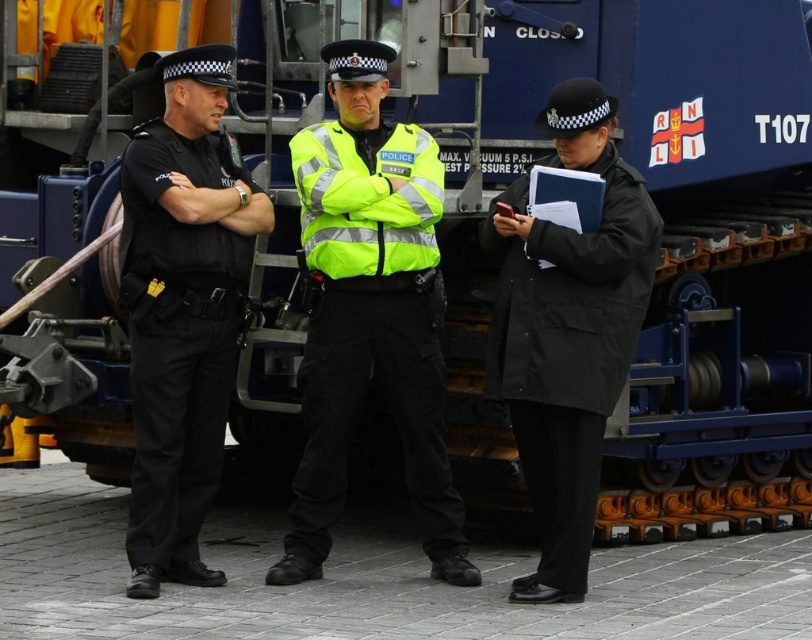
Question: Estimate the real-world distances between objects in this image. Which object is closer to the black uniform at left?

Choices:
 (A) black matte coat at center
 (B) neon yellow reflective jacket at center

Answer: (B)

Question: Is black uniform at left positioned in front of black matte coat at center?

Choices:
 (A) no
 (B) yes

Answer: (A)

Question: Can you confirm if neon yellow reflective jacket at center is positioned above black uniform at left?

Choices:
 (A) no
 (B) yes

Answer: (B)

Question: Does neon yellow reflective jacket at center appear over black matte coat at center?

Choices:
 (A) no
 (B) yes

Answer: (B)

Question: Which of these objects is positioned farthest from the black matte coat at center?

Choices:
 (A) black uniform at left
 (B) neon yellow reflective jacket at center

Answer: (A)

Question: Which point is closer to the camera?

Choices:
 (A) (223, 387)
 (B) (297, 532)
 (C) (504, 358)

Answer: (C)